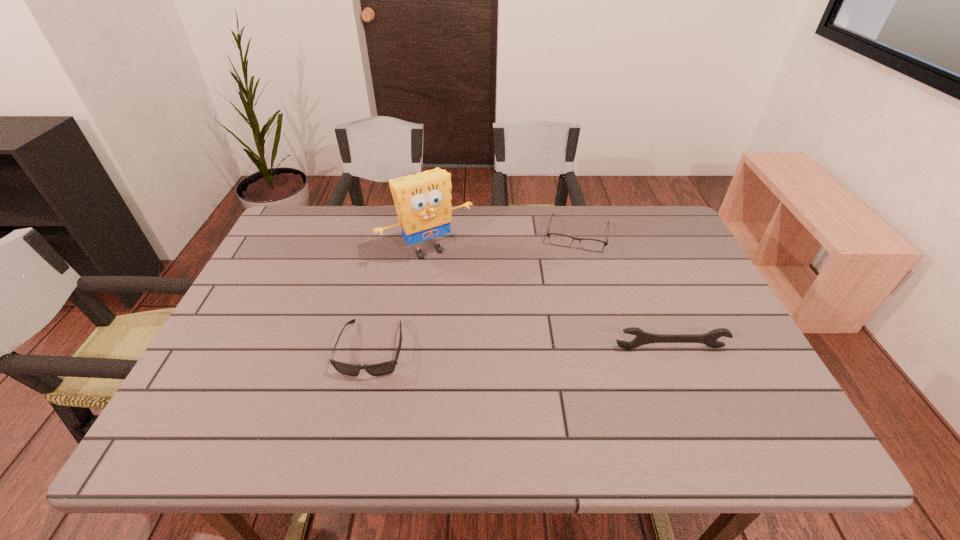
Where is `sunglasses`? sunglasses is located at coordinates (384, 368).

At what (x,y) coordinates should I click in order to perform the action: click on the third shortest object. Please return your answer as a coordinate pair (x, y). This screenshot has width=960, height=540. Looking at the image, I should click on (642, 338).

You are a GUI agent. You are given a task and a screenshot of the screen. Output one action in this format:
    pyautogui.click(x=<x>, y=<y>)
    Task: Click on the spectacles
    This screenshot has width=960, height=540.
    Given the screenshot: What is the action you would take?
    pyautogui.click(x=557, y=239)

Identify the location of sponge. Image resolution: width=960 pixels, height=540 pixels. (423, 204).

This screenshot has height=540, width=960. I want to click on vacant space situated on the front-facing side of the sunglasses, so click(x=359, y=407).

In order to click on vacant space situated on the open ends of the wrench in this screenshot , I will do `click(690, 397)`.

Where is `vacant space located on the front-facing side of the spectacles`? vacant space located on the front-facing side of the spectacles is located at coordinates (565, 299).

Where is `blank area located 0.100m on the front-facing side of the spectacles`? The width and height of the screenshot is (960, 540). blank area located 0.100m on the front-facing side of the spectacles is located at coordinates (570, 275).

Locate an element on the screen. The height and width of the screenshot is (540, 960). vacant space located 0.290m on the front-facing side of the spectacles is located at coordinates (562, 323).

At what (x,y) coordinates should I click in order to perform the action: click on free location located on the face of the tallest object. Please return your answer as a coordinate pair (x, y). This screenshot has height=540, width=960. Looking at the image, I should click on (466, 289).